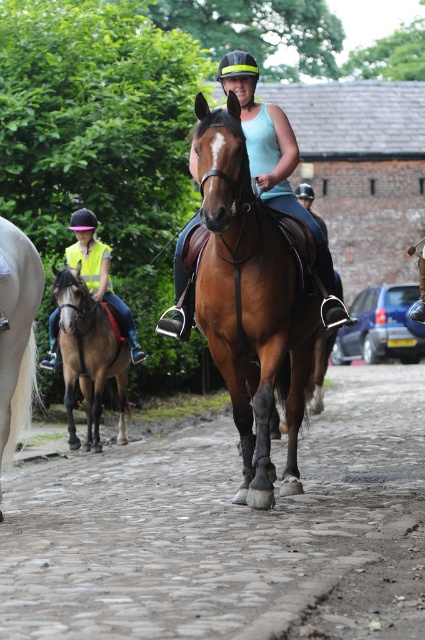
You are a photographer trying to capture the scene of the riders on the cobblestone path. You want to ensure that both the brown cobblestone at center and the white glossy horse at left are clearly visible in your shot. Given their sizes, which object should you focus on first to ensure proper framing?

The brown cobblestone at center is bigger than the white glossy horse at left, so focusing on the brown cobblestone at center first will help ensure proper framing since it occupies more space in the scene.

You are a photographer positioned on the cobblestone path. You want to take a photo of the white glossy horse at left and the yellow reflective vest at left. Based on their sizes, which one should you zoom in on more to ensure both are clearly visible in the frame?

The white glossy horse at left is smaller than the yellow reflective vest at left, so you should zoom in more on the white glossy horse at left to balance their sizes in the photo.